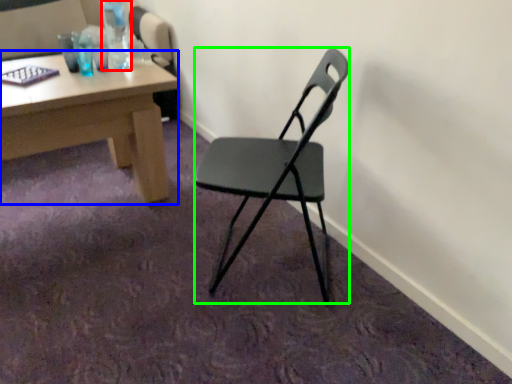
Question: Which object is the closest to the bottle (highlighted by a red box)? Choose among these: desk (highlighted by a blue box) or chair (highlighted by a green box).

Choices:
 (A) desk
 (B) chair

Answer: (A)